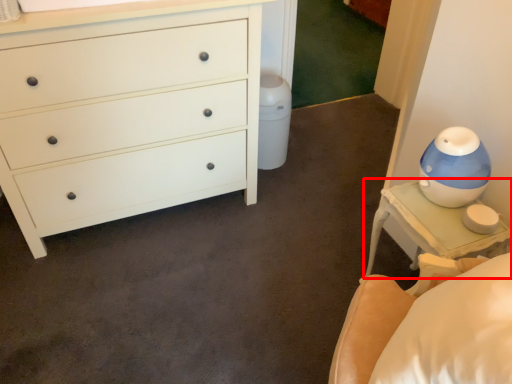
Question: Considering the relative positions of nightstand (annotated by the red box) and chest of drawers in the image provided, where is nightstand (annotated by the red box) located with respect to the staircase?

Choices:
 (A) left
 (B) right

Answer: (B)